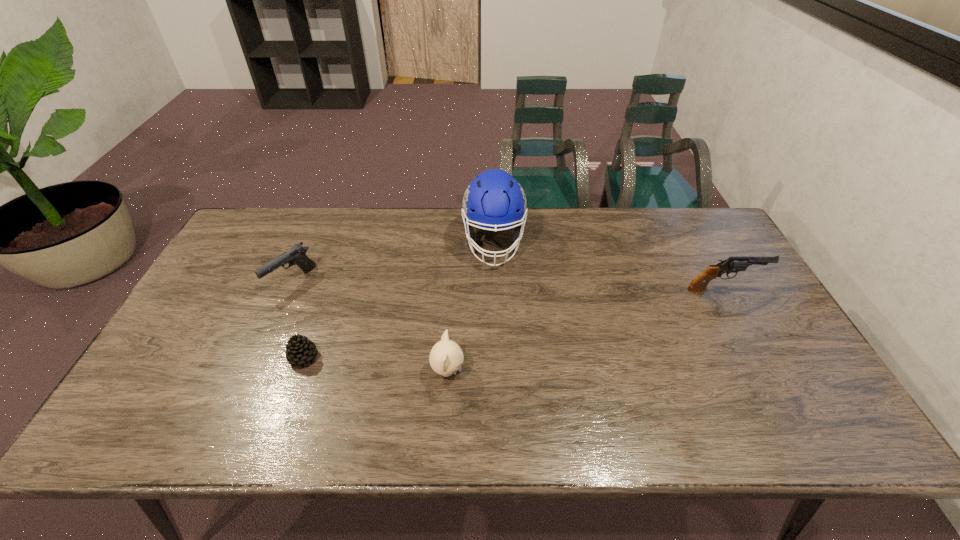
Locate an element on the screen. This screenshot has width=960, height=540. vacant space situated 0.130m on the face of the kitten is located at coordinates (516, 371).

This screenshot has height=540, width=960. Find the location of `vacant space located 0.160m at the narrow end of the pinecone`. vacant space located 0.160m at the narrow end of the pinecone is located at coordinates (278, 431).

Image resolution: width=960 pixels, height=540 pixels. Identify the location of object positioned at the far edge. (494, 199).

At what (x,y) coordinates should I click in order to perform the action: click on object that is at the right edge. Please return your answer as a coordinate pair (x, y). Looking at the image, I should click on (734, 264).

The width and height of the screenshot is (960, 540). What are the coordinates of `vacant area at the far edge of the desktop` in the screenshot? It's located at (554, 241).

The width and height of the screenshot is (960, 540). What are the coordinates of `free space at the near edge of the desktop` in the screenshot? It's located at (667, 428).

This screenshot has width=960, height=540. I want to click on free space at the left edge of the desktop, so click(x=174, y=349).

At what (x,y) coordinates should I click in order to perform the action: click on vacant position at the far left corner of the desktop. Please return your answer as a coordinate pair (x, y). This screenshot has height=540, width=960. Looking at the image, I should click on (260, 230).

This screenshot has height=540, width=960. I want to click on vacant space at the far right corner of the desktop, so click(x=714, y=240).

Find the location of `free space between the fourth shortest object and the shortest object`. free space between the fourth shortest object and the shortest object is located at coordinates (514, 323).